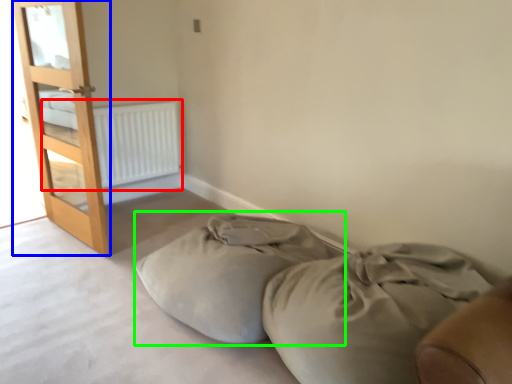
Question: Estimate the real-world distances between objects in this image. Which object is farther from radiator (highlighted by a red box), door (highlighted by a blue box) or bean bag chair (highlighted by a green box)?

Choices:
 (A) door
 (B) bean bag chair

Answer: (B)